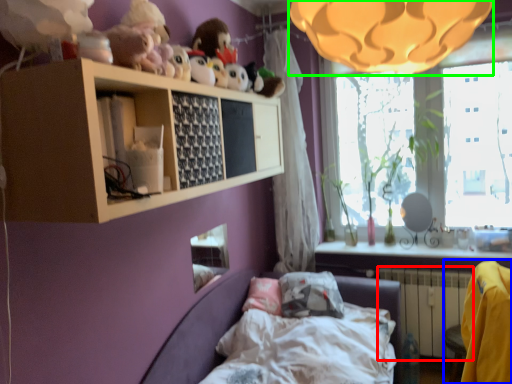
Question: Which is nearer to the radiator (highlighted by a red box)? armchair (highlighted by a blue box) or lamp (highlighted by a green box).

Choices:
 (A) armchair
 (B) lamp

Answer: (A)